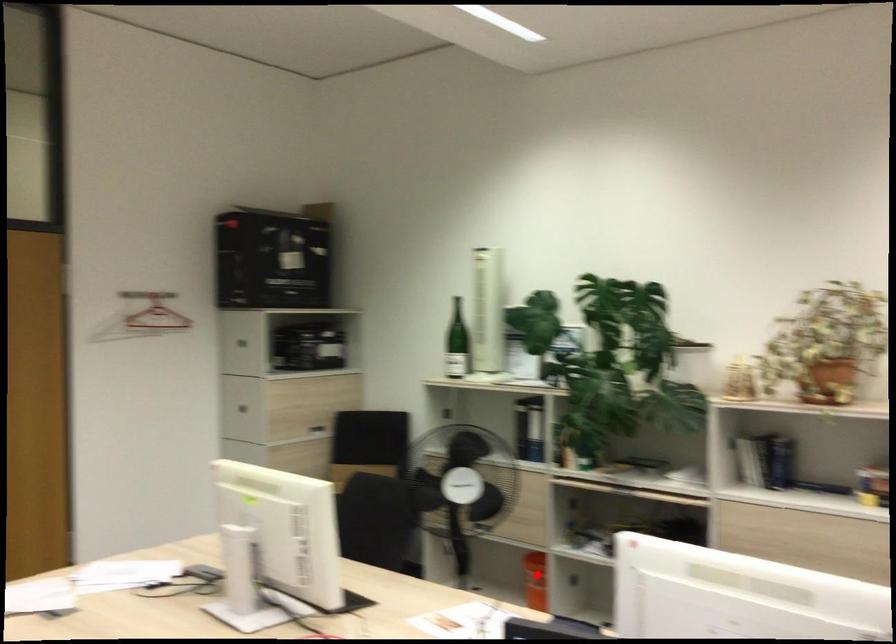
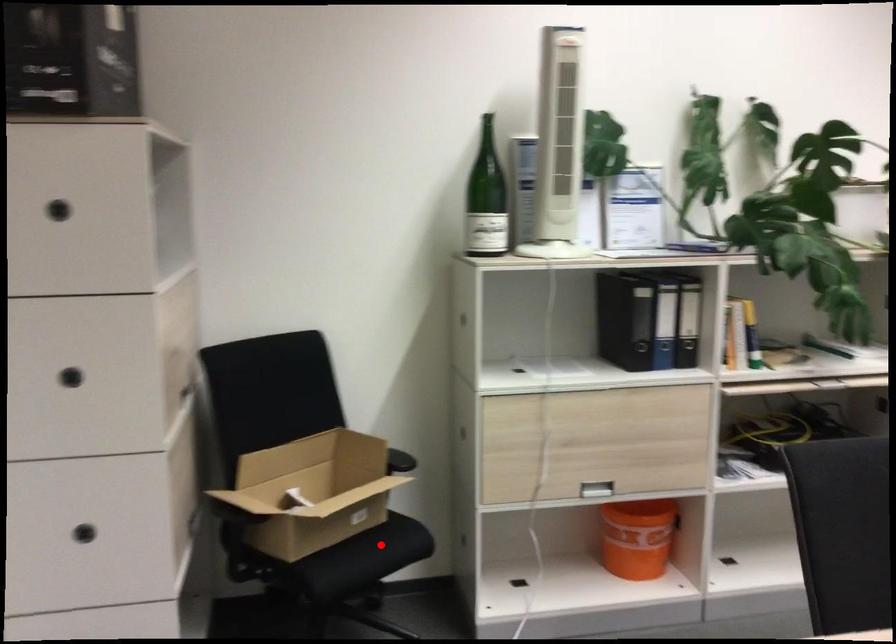
I am providing you with two images of the same scene from different viewpoints. A red point is marked on the first image and another point is marked on the second image. Is the marked point in image1 the same physical position as the marked point in image2?

No